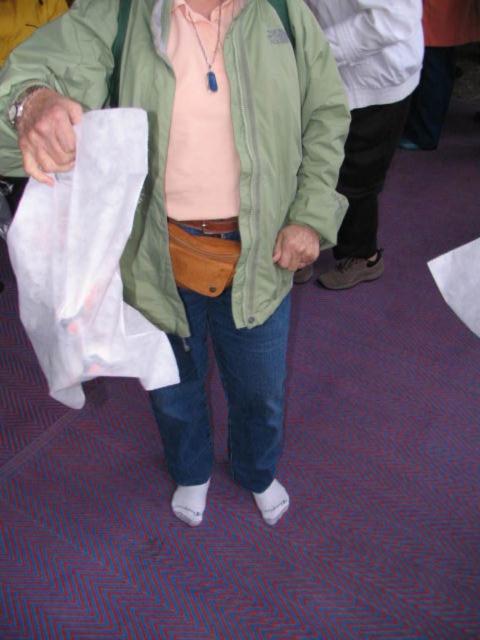
Between green matte jacket at center and leather glove at lower left, which one is positioned higher?

Positioned higher is green matte jacket at center.

Looking at this image, does green matte jacket at center have a smaller size compared to leather glove at lower left?

Actually, green matte jacket at center might be larger than leather glove at lower left.

Locate an element on the screen. green matte jacket at center is located at coordinates (282, 141).